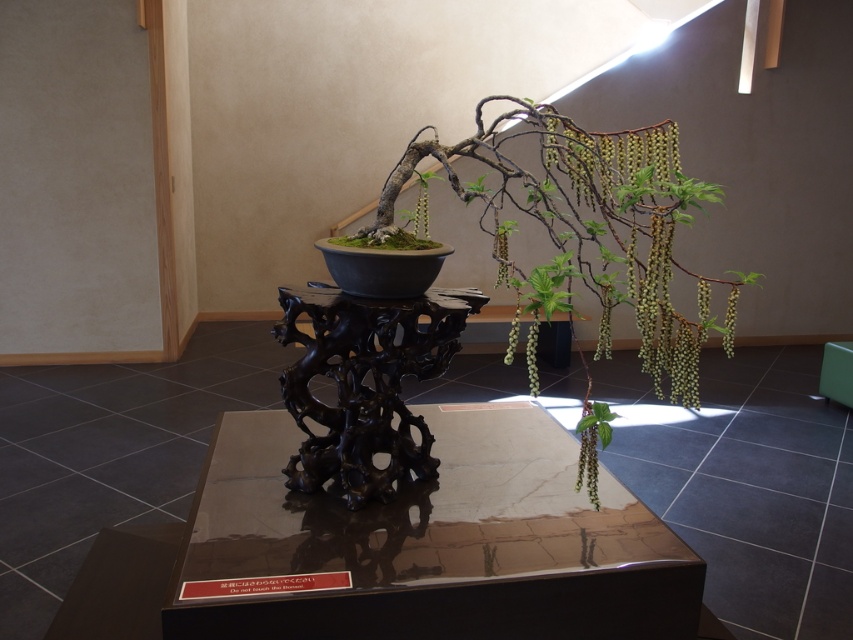
You are a gardener who wants to place a new green matte plant at center in the same room as the green matte bonsai tree at center. Since both are green and matte, will the new plant be easily distinguishable from the existing bonsai tree?

The green matte bonsai tree at center is larger in size than the green matte plant at center, so the new plant will be distinguishable due to its smaller size compared to the existing bonsai tree.

You are arranging a display and need to place both the glossy dark wood table at center and the green matte bonsai tree at center. Which object takes up more space?

The green matte bonsai tree at center takes up more space than the glossy dark wood table at center.

In the scene shown: You are an art curator examining the bonsai tree arrangement. You notice two points marked on the bonsai tree. One is at point (177, 605) and the other at point (426, 216). Which of these points is positioned closer to your viewpoint?

Point (177, 605) is closer to the viewer than point (426, 216).